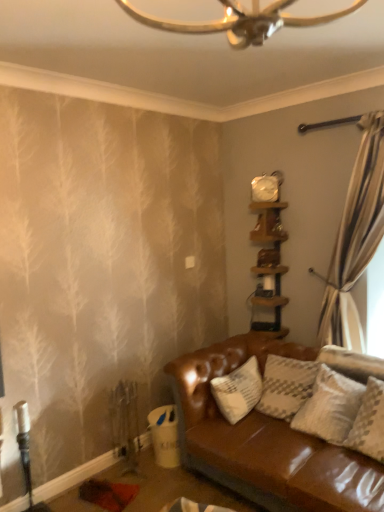
Question: Is wooden shelf at upper right, placed as the 2th shelf when sorted from top to bottom, inside or outside of wooden shelf at upper right, the second shelf positioned from the bottom?

Choices:
 (A) outside
 (B) inside

Answer: (A)

Question: Is wooden shelf at upper right, which is the first shelf from bottom to top, in front of or behind wooden shelf at upper right, the 1th shelf from the top, in the image?

Choices:
 (A) front
 (B) behind

Answer: (A)

Question: Considering the real-world distances, which object is farthest from the wooden shelf at upper right, the 1th shelf from the top?

Choices:
 (A) wooden shelf at upper right, which is the first shelf from bottom to top
 (B) white glossy clock at upper center

Answer: (A)

Question: Which object is the farthest from the wooden shelf at upper right, the second shelf positioned from the bottom?

Choices:
 (A) wooden shelf at upper right, which is the first shelf from bottom to top
 (B) white glossy clock at upper center

Answer: (A)